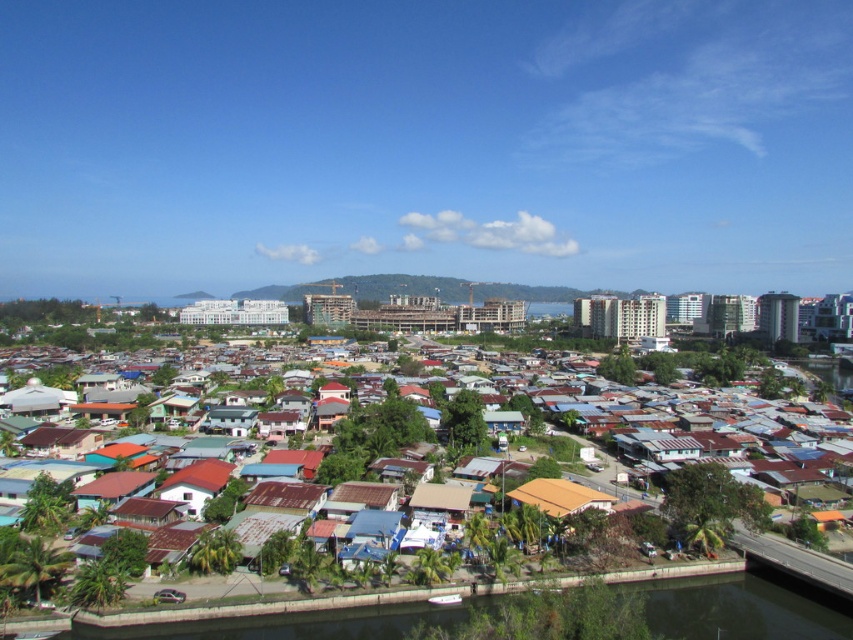
You are a delivery person trying to locate a package left at the rusty corrugated metal hut at center and the brown corrugated metal hut at center. Which one is on the right side when facing the huts from the front?

The rusty corrugated metal hut at center is positioned on the right side of the brown corrugated metal hut at center, so it is the one on the right.

You are a city planner reviewing this urban area. The rusty corrugated metal hut at center is part of a proposed redevelopment zone. Based on its position, can you determine if it is situated in the foreground or midground of the image?

The rusty corrugated metal hut at center is located at point coordinates that place it in the foreground of the image, as the foreground contains clusters of small houses like this.

You are a delivery person trying to park your van between the rusty corrugated metal hut at center and the brown corrugated metal hut at center. The van is 2 meters wide. Can you fit it there?

The rusty corrugated metal hut at center might be wider than brown corrugated metal hut at center, but the exact width difference isn not specified. Without knowing the exact width of the space between them, it is uncertain if the van can fit. Please measure the space before attempting to park.